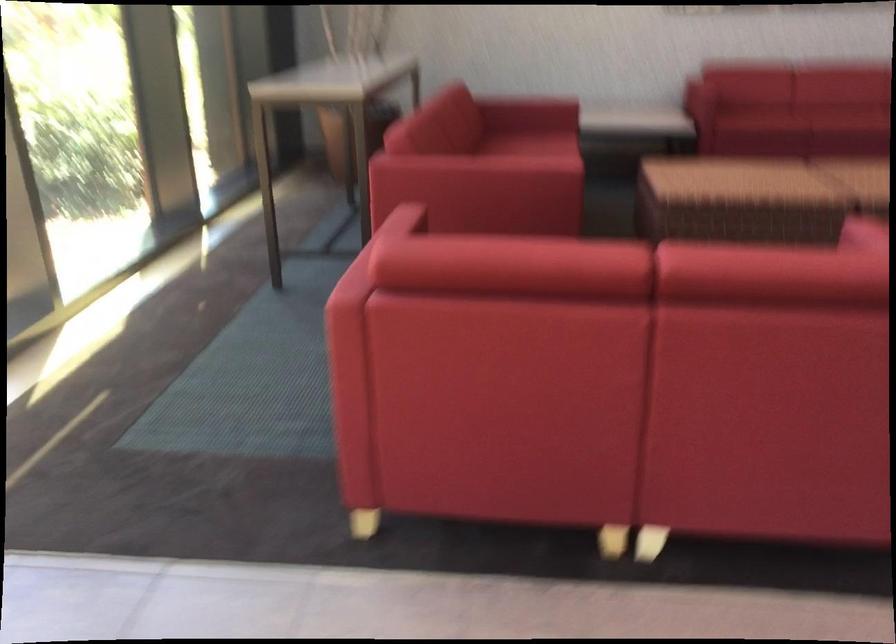
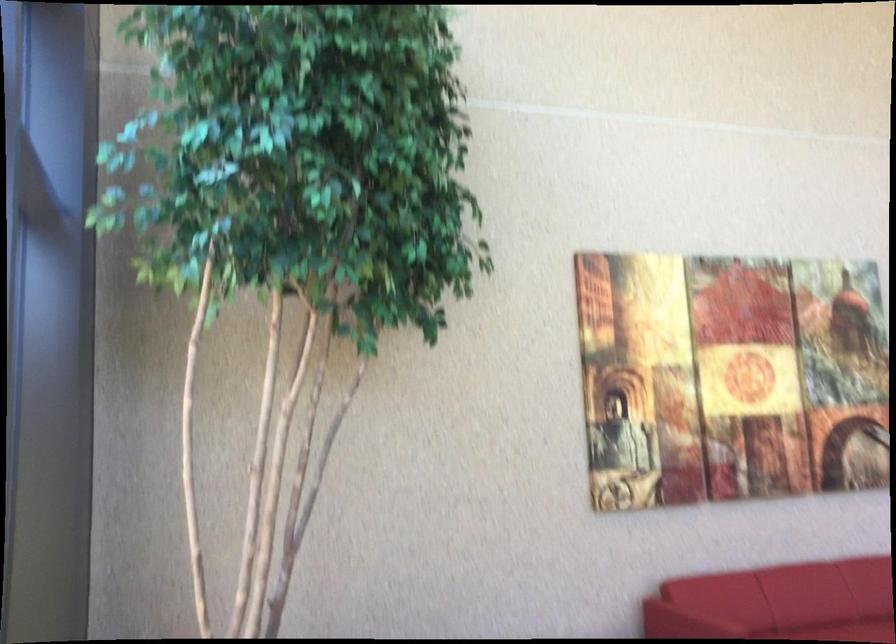
Question: Which direction would the cameraman need to move to produce the second image? Reply with the corresponding letter.

Choices:
 (A) Left
 (B) Right
 (C) Forward
 (D) Backward

Answer: (D)